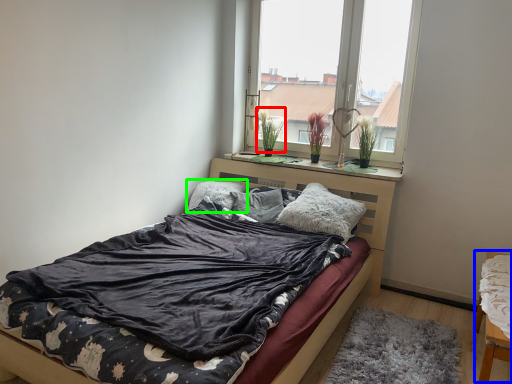
Question: Considering the real-world distances, which object is farthest from plant (highlighted by a red box)? chair (highlighted by a blue box) or pillow (highlighted by a green box)?

Choices:
 (A) chair
 (B) pillow

Answer: (A)